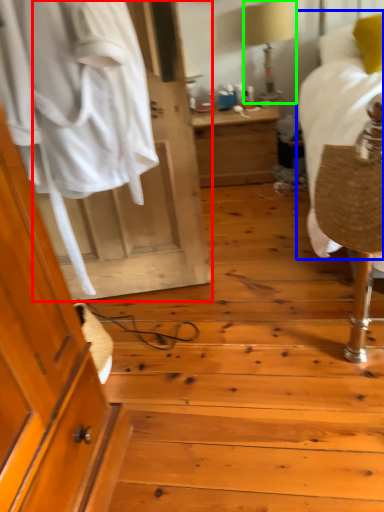
Question: Considering the real-world distances, which object is closest to door (highlighted by a red box)? bed (highlighted by a blue box) or table lamp (highlighted by a green box).

Choices:
 (A) bed
 (B) table lamp

Answer: (A)